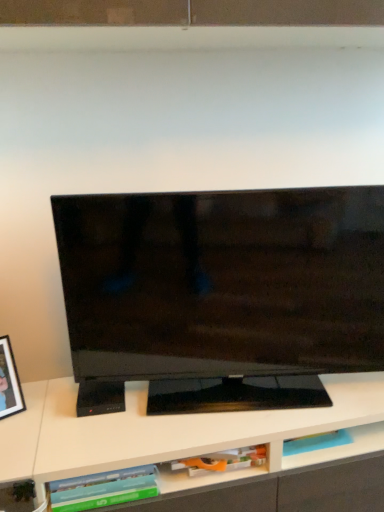
Question: Is green matte book at lower center, the second book positioned from the right, oriented towards black glossy tv at center?

Choices:
 (A) yes
 (B) no

Answer: (B)

Question: From a real-world perspective, is green matte book at lower center, the second book positioned from the right, positioned under black glossy tv at center based on gravity?

Choices:
 (A) no
 (B) yes

Answer: (B)

Question: Is the depth of green matte book at lower center, positioned as the 1th book in left-to-right order, greater than that of black glossy tv at center?

Choices:
 (A) yes
 (B) no

Answer: (B)

Question: Is green matte book at lower center, positioned as the 1th book in left-to-right order, thinner than black glossy tv at center?

Choices:
 (A) no
 (B) yes

Answer: (A)

Question: Is the surface of green matte book at lower center, the second book positioned from the right, in direct contact with black glossy tv at center?

Choices:
 (A) no
 (B) yes

Answer: (A)

Question: Visually, is black matte picture frame at left positioned to the left or to the right of black glossy tv at center?

Choices:
 (A) right
 (B) left

Answer: (B)

Question: From the image's perspective, is black matte picture frame at left above or below black glossy tv at center?

Choices:
 (A) above
 (B) below

Answer: (B)

Question: Considering the positions of point (0, 344) and point (334, 237), is point (0, 344) closer or farther from the camera than point (334, 237)?

Choices:
 (A) farther
 (B) closer

Answer: (A)

Question: From a real-world perspective, is black matte picture frame at left physically located above or below black glossy tv at center?

Choices:
 (A) above
 (B) below

Answer: (B)

Question: In terms of width, does matte orange book at lower center, the 2th book from the left, look wider or thinner when compared to black matte picture frame at left?

Choices:
 (A) thin
 (B) wide

Answer: (B)

Question: In terms of height, does matte orange book at lower center, which is the 1th book from right to left, look taller or shorter compared to black matte picture frame at left?

Choices:
 (A) tall
 (B) short

Answer: (B)

Question: From the image's perspective, is matte orange book at lower center, the 2th book from the left, positioned above or below black matte picture frame at left?

Choices:
 (A) below
 (B) above

Answer: (A)

Question: From a real-world perspective, is matte orange book at lower center, which is the 1th book from right to left, above or below black matte picture frame at left?

Choices:
 (A) above
 (B) below

Answer: (B)

Question: From a real-world perspective, is black matte picture frame at left above or below matte orange book at lower center, the 2th book from the left?

Choices:
 (A) below
 (B) above

Answer: (B)

Question: In terms of size, does black matte picture frame at left appear bigger or smaller than matte orange book at lower center, the 2th book from the left?

Choices:
 (A) small
 (B) big

Answer: (B)